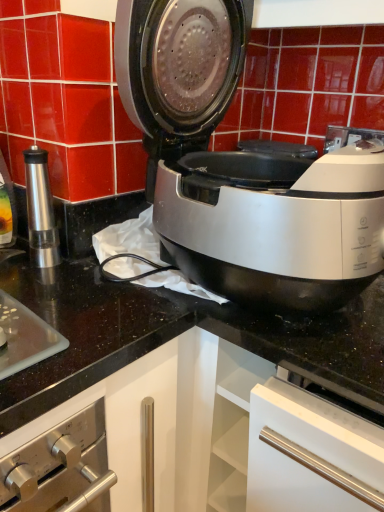
What are the coordinates of `metallic silver pepper grinder at left` in the screenshot? It's located at click(x=40, y=210).

In the scene shown: What is the approximate width of metallic silver pepper grinder at left?

metallic silver pepper grinder at left is 2.59 inches in width.

The height and width of the screenshot is (512, 384). What do you see at coordinates (40, 210) in the screenshot?
I see `metallic silver pepper grinder at left` at bounding box center [40, 210].

What is the approximate width of satin silver air fryer at center?

The width of satin silver air fryer at center is 16.64 inches.

Where is `satin silver air fryer at center`? satin silver air fryer at center is located at coordinates (234, 167).

Describe the element at coordinates (234, 167) in the screenshot. I see `satin silver air fryer at center` at that location.

Find the location of a particular element. The image size is (384, 512). metallic silver pepper grinder at left is located at coordinates (40, 210).

Is satin silver air fryer at center to the right of metallic silver pepper grinder at left from the viewer's perspective?

Correct, you'll find satin silver air fryer at center to the right of metallic silver pepper grinder at left.

Is satin silver air fryer at center in front of or behind metallic silver pepper grinder at left in the image?

satin silver air fryer at center is in front of metallic silver pepper grinder at left.

Is point (259, 288) less distant than point (44, 153)?

Yes, it is.

From the image's perspective, relative to metallic silver pepper grinder at left, is satin silver air fryer at center above or below?

Based on their image positions, satin silver air fryer at center is located above metallic silver pepper grinder at left.

From a real-world perspective, is satin silver air fryer at center below metallic silver pepper grinder at left?

Actually, satin silver air fryer at center is physically above metallic silver pepper grinder at left in the real world.

Between satin silver air fryer at center and metallic silver pepper grinder at left, which one has larger width?

satin silver air fryer at center is wider.

Can you confirm if satin silver air fryer at center is shorter than metallic silver pepper grinder at left?

In fact, satin silver air fryer at center may be taller than metallic silver pepper grinder at left.

In the scene shown: Who is smaller, satin silver air fryer at center or metallic silver pepper grinder at left?

metallic silver pepper grinder at left.

Choose the correct answer: Is satin silver air fryer at center inside metallic silver pepper grinder at left or outside it?

The correct answer is: outside.

Is satin silver air fryer at center next to metallic silver pepper grinder at left and touching it?

satin silver air fryer at center is not next to metallic silver pepper grinder at left, and they're not touching.

Does satin silver air fryer at center turn towards metallic silver pepper grinder at left?

No, satin silver air fryer at center is not facing towards metallic silver pepper grinder at left.

How much distance is there between satin silver air fryer at center and metallic silver pepper grinder at left?

The distance of satin silver air fryer at center from metallic silver pepper grinder at left is 30.92 centimeters.

Image resolution: width=384 pixels, height=512 pixels. In the image, there is a satin silver air fryer at center. What are the coordinates of `kitchen appliance below it (from the image's perspective)` in the screenshot? It's located at (40, 210).

Can you confirm if metallic silver pepper grinder at left is positioned to the left of satin silver air fryer at center?

Yes.

Which object is further away from the camera taking this photo, metallic silver pepper grinder at left or satin silver air fryer at center?

metallic silver pepper grinder at left is behind.

Does point (35, 178) come farther from viewer compared to point (300, 182)?

That is True.

From the image's perspective, who appears lower, metallic silver pepper grinder at left or satin silver air fryer at center?

metallic silver pepper grinder at left is shown below in the image.

From a real-world perspective, who is located lower, metallic silver pepper grinder at left or satin silver air fryer at center?

From a 3D spatial view, metallic silver pepper grinder at left is below.

Considering the sizes of objects metallic silver pepper grinder at left and satin silver air fryer at center in the image provided, who is wider, metallic silver pepper grinder at left or satin silver air fryer at center?

satin silver air fryer at center.

Is metallic silver pepper grinder at left taller or shorter than satin silver air fryer at center?

Clearly, metallic silver pepper grinder at left is shorter compared to satin silver air fryer at center.

Looking at this image, can you confirm if metallic silver pepper grinder at left is smaller than satin silver air fryer at center?

Indeed, metallic silver pepper grinder at left has a smaller size compared to satin silver air fryer at center.

Looking at this image, is satin silver air fryer at center inside metallic silver pepper grinder at left?

No, satin silver air fryer at center is located outside of metallic silver pepper grinder at left.

Are metallic silver pepper grinder at left and satin silver air fryer at center making contact?

No, metallic silver pepper grinder at left is not next to satin silver air fryer at center.

Is metallic silver pepper grinder at left positioned with its back to satin silver air fryer at center?

No.

How different are the orientations of metallic silver pepper grinder at left and satin silver air fryer at center in degrees?

The angle between the facing direction of metallic silver pepper grinder at left and the facing direction of satin silver air fryer at center is 0.00113 degrees.

From the picture: How distant is metallic silver pepper grinder at left from satin silver air fryer at center?

metallic silver pepper grinder at left is 12.17 inches away from satin silver air fryer at center.

This screenshot has height=512, width=384. Find the location of `kitchen appliance on the left of satin silver air fryer at center`. kitchen appliance on the left of satin silver air fryer at center is located at coordinates (40, 210).

Locate an element on the screen. The height and width of the screenshot is (512, 384). home appliance lying in front of the metallic silver pepper grinder at left is located at coordinates (234, 167).

Where is `kitchen appliance located underneath the satin silver air fryer at center (from a real-world perspective)`? kitchen appliance located underneath the satin silver air fryer at center (from a real-world perspective) is located at coordinates (40, 210).